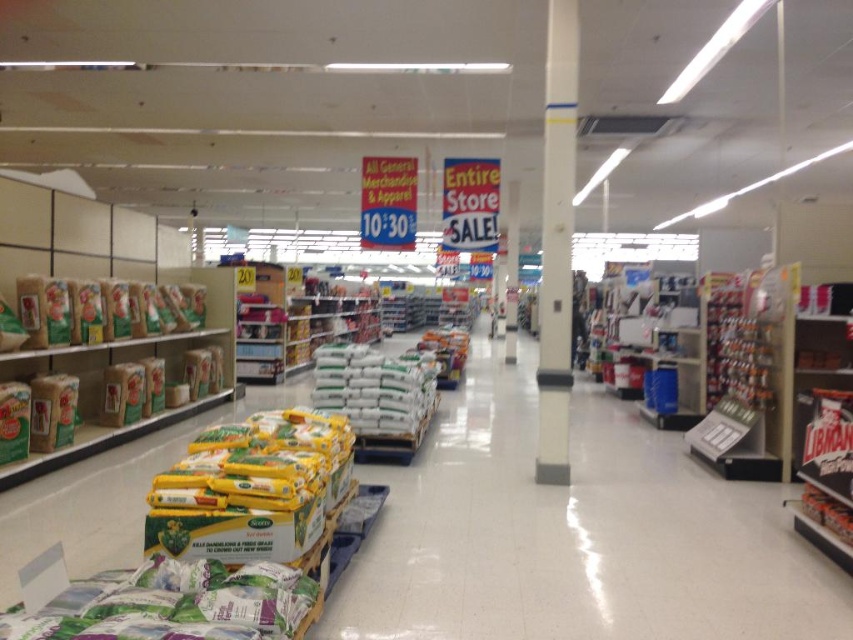
Can you confirm if white matte bags at center is taller than white matte bag at center?

No.

Is point (373, 429) in front of point (450, 349)?

Yes.

Does point (354, 432) come behind point (434, 330)?

No.

Locate an element on the screen. The height and width of the screenshot is (640, 853). white matte bags at center is located at coordinates (375, 388).

In the scene shown: Who is taller, brown cardboard boxes at left or white glossy pillar at center?

white glossy pillar at center

Between brown cardboard boxes at left and white glossy pillar at center, which one appears on the left side from the viewer's perspective?

brown cardboard boxes at left is more to the left.

Identify the location of brown cardboard boxes at left. Image resolution: width=853 pixels, height=640 pixels. (134, 364).

I want to click on brown cardboard boxes at left, so click(134, 364).

Is matte brown bag at left bigger than white matte bags at center?

No, matte brown bag at left is not bigger than white matte bags at center.

Does matte brown bag at left have a greater width compared to white matte bags at center?

Incorrect, matte brown bag at left's width does not surpass white matte bags at center's.

Which is behind, point (132, 337) or point (399, 422)?

Point (132, 337)

The image size is (853, 640). In order to click on matte brown bag at left in this screenshot , I will do `click(96, 310)`.